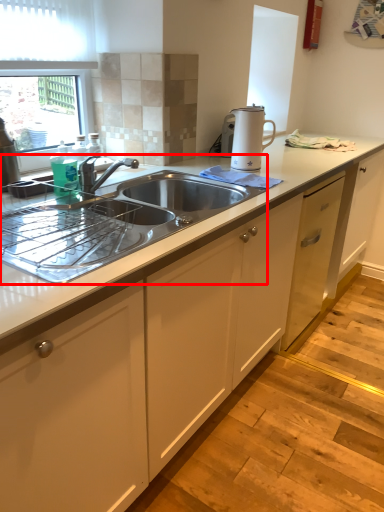
Question: From the image's perspective, where is sink (annotated by the red box) located relative to home appliance?

Choices:
 (A) below
 (B) above

Answer: (A)